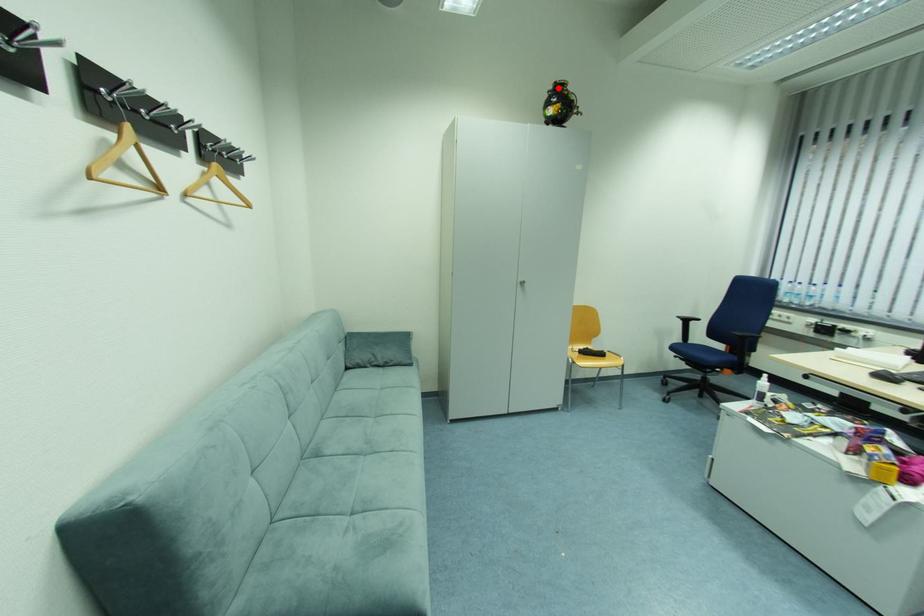
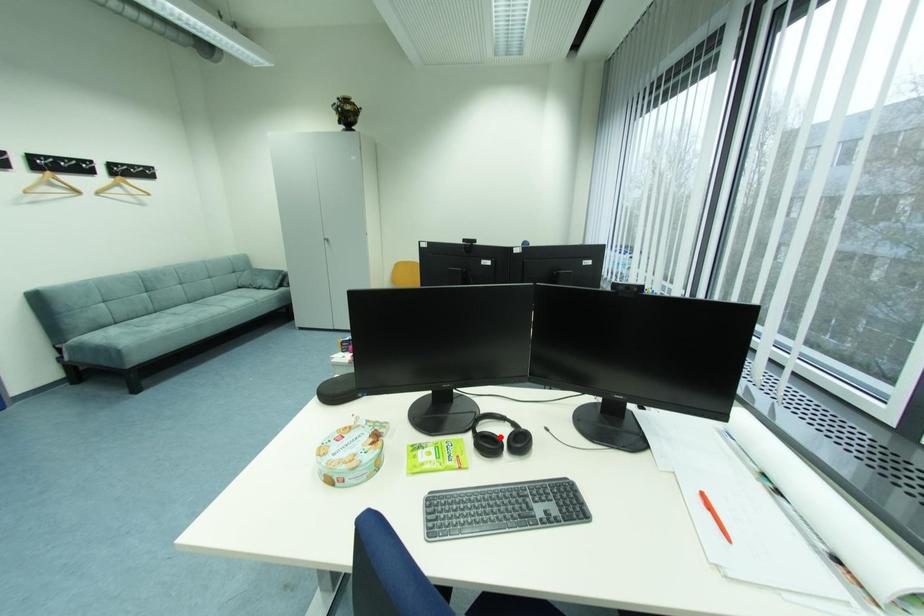
I am providing you with two images of the same scene from different viewpoints. A red point is marked on the first image and another point is marked on the second image. Is the marked point in image1 the same physical position as the marked point in image2?

No